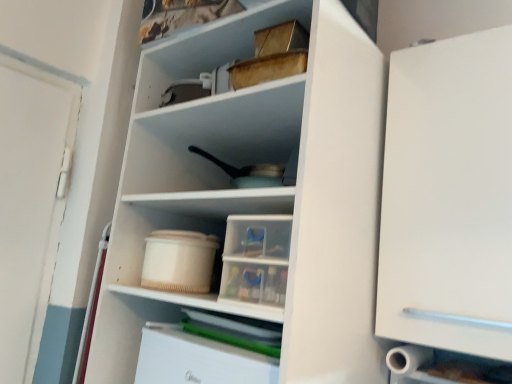
What is the approximate width of white plastic drawer at lower center, which is the 2th cabinetry from right to left?

45.67 centimeters.

This screenshot has height=384, width=512. Find the location of `white matte cabinet at right, which is counted as the second cabinetry, starting from the bottom`. white matte cabinet at right, which is counted as the second cabinetry, starting from the bottom is located at coordinates (448, 197).

Which is more distant, (306, 9) or (180, 276)?

The point (180, 276) is more distant.

Considering the relative sizes of wooden box at upper center and beige plastic container at center in the image provided, is wooden box at upper center taller than beige plastic container at center?

Yes, wooden box at upper center is taller than beige plastic container at center.

How many degrees apart are the facing directions of wooden box at upper center and beige plastic container at center?

wooden box at upper center and beige plastic container at center are facing 1.54 degrees away from each other.

Who is more distant, wooden box at upper center or beige plastic container at center?

beige plastic container at center is further away from the camera.

Is white plastic drawer at lower center, the 2th cabinetry from the top, positioned in front of beige plastic container at center?

Yes, white plastic drawer at lower center, the 2th cabinetry from the top, is closer to the camera.

Considering the sizes of objects white plastic drawer at lower center, which is the 2th cabinetry from right to left, and beige plastic container at center in the image provided, who is taller, white plastic drawer at lower center, which is the 2th cabinetry from right to left, or beige plastic container at center?

Standing taller between the two is white plastic drawer at lower center, which is the 2th cabinetry from right to left.

Based on their positions, is white plastic drawer at lower center, which is the 2th cabinetry from right to left, located to the left or right of beige plastic container at center?

white plastic drawer at lower center, which is the 2th cabinetry from right to left, is positioned on beige plastic container at center's right side.

From the image's perspective, is white plastic drawer at lower center, the 2th cabinetry from the top, over beige plastic container at center?

Actually, white plastic drawer at lower center, the 2th cabinetry from the top, appears below beige plastic container at center in the image.

Which is correct: white plastic drawer at lower center, the 1th cabinetry when ordered from bottom to top, is inside wooden box at upper center, or outside of it?

white plastic drawer at lower center, the 1th cabinetry when ordered from bottom to top, is located beyond the bounds of wooden box at upper center.

Is white plastic drawer at lower center, the 2th cabinetry from the top, touching wooden box at upper center?

No, white plastic drawer at lower center, the 2th cabinetry from the top, is not next to wooden box at upper center.

Which is closer to the camera, (187, 342) or (149, 103)?

Clearly, point (187, 342) is closer to the camera than point (149, 103).

Considering the relative sizes of white plastic drawer at lower center, which is the 1th cabinetry from left to right, and wooden box at upper center in the image provided, is white plastic drawer at lower center, which is the 1th cabinetry from left to right, smaller than wooden box at upper center?

Yes, white plastic drawer at lower center, which is the 1th cabinetry from left to right, is smaller than wooden box at upper center.

Is white matte cabinet at right, positioned as the first cabinetry in right-to-left order, wider or thinner than beige plastic container at center?

Considering their sizes, white matte cabinet at right, positioned as the first cabinetry in right-to-left order, looks broader than beige plastic container at center.

Is beige plastic container at center completely or partially inside white matte cabinet at right, which is counted as the second cabinetry, starting from the bottom?

No, beige plastic container at center is located outside of white matte cabinet at right, which is counted as the second cabinetry, starting from the bottom.

Can you confirm if white matte cabinet at right, marked as the second cabinetry in a left-to-right arrangement, is bigger than beige plastic container at center?

Yes.

Is point (451, 132) behind point (158, 331)?

No.

Which is more to the left, white matte cabinet at right, which is counted as the second cabinetry, starting from the bottom, or white plastic drawer at lower center, the 2th cabinetry from the top?

From the viewer's perspective, white plastic drawer at lower center, the 2th cabinetry from the top, appears more on the left side.

Is the position of white matte cabinet at right, marked as the second cabinetry in a left-to-right arrangement, less distant than that of white plastic drawer at lower center, the 1th cabinetry when ordered from bottom to top?

That is False.

In the scene shown: From the image's perspective, relative to white plastic drawer at lower center, which is the 2th cabinetry from right to left, is white matte cabinet at right, marked as the second cabinetry in a left-to-right arrangement, above or below?

From the image's perspective, white matte cabinet at right, marked as the second cabinetry in a left-to-right arrangement, appears above white plastic drawer at lower center, which is the 2th cabinetry from right to left.

From a real-world perspective, is white matte cabinet at right, marked as the second cabinetry in a left-to-right arrangement, positioned above or below wooden box at upper center?

From a real-world perspective, white matte cabinet at right, marked as the second cabinetry in a left-to-right arrangement, is physically below wooden box at upper center.

Is white matte cabinet at right, which is the 1th cabinetry from top to bottom, taller than wooden box at upper center?

Correct, white matte cabinet at right, which is the 1th cabinetry from top to bottom, is much taller as wooden box at upper center.

You are a GUI agent. You are given a task and a screenshot of the screen. Output one action in this format:
    pyautogui.click(x=<x>, y=<y>)
    Task: Click on the shelf positioned vertically above the white matte cabinet at right, positioned as the first cabinetry in right-to-left order (from a real-world perspective)
    This screenshot has height=384, width=512.
    Given the screenshot: What is the action you would take?
    coord(219,41)

From the image's perspective, is white matte cabinet at right, positioned as the first cabinetry in right-to-left order, located above wooden box at upper center?

Incorrect, from the image's perspective, white matte cabinet at right, positioned as the first cabinetry in right-to-left order, is lower than wooden box at upper center.

Image resolution: width=512 pixels, height=384 pixels. I want to click on storage box behind the white matte cabinet at right, which is counted as the second cabinetry, starting from the bottom, so click(x=179, y=261).

From a real-world perspective, is beige plastic container at center positioned over white matte cabinet at right, which is counted as the second cabinetry, starting from the bottom, based on gravity?

No, from a real-world perspective, beige plastic container at center is not over white matte cabinet at right, which is counted as the second cabinetry, starting from the bottom

From the picture: Which object is thinner, beige plastic container at center or white matte cabinet at right, which is the 1th cabinetry from top to bottom?

Thinner between the two is beige plastic container at center.

Locate an element on the screen. The width and height of the screenshot is (512, 384). storage box that appears on the left of wooden box at upper center is located at coordinates (179, 261).

Find the location of `storage box located behind the white plastic drawer at lower center, the 1th cabinetry when ordered from bottom to top`. storage box located behind the white plastic drawer at lower center, the 1th cabinetry when ordered from bottom to top is located at coordinates (179, 261).

From the image, which object appears to be nearer to white matte cabinet at right, positioned as the first cabinetry in right-to-left order, wooden box at upper center or white plastic drawer at lower center, which is the 1th cabinetry from left to right?

wooden box at upper center is positioned closer to the anchor white matte cabinet at right, positioned as the first cabinetry in right-to-left order.

Estimate the real-world distances between objects in this image. Which object is closer to wooden box at upper center, white plastic drawer at lower center, which is the 2th cabinetry from right to left, or white matte cabinet at right, marked as the second cabinetry in a left-to-right arrangement?

The object closer to wooden box at upper center is white matte cabinet at right, marked as the second cabinetry in a left-to-right arrangement.

In the scene shown: Based on their spatial positions, is white matte cabinet at right, which is counted as the second cabinetry, starting from the bottom, or white plastic drawer at lower center, which is the 2th cabinetry from right to left, closer to beige plastic container at center?

white plastic drawer at lower center, which is the 2th cabinetry from right to left.

Based on their spatial positions, is beige plastic container at center or white matte cabinet at right, marked as the second cabinetry in a left-to-right arrangement, closer to wooden box at upper center?

beige plastic container at center lies closer to wooden box at upper center than the other object.

When comparing their distances from white plastic drawer at lower center, which is the 1th cabinetry from left to right, does wooden box at upper center or beige plastic container at center seem closer?

beige plastic container at center is closer to white plastic drawer at lower center, which is the 1th cabinetry from left to right.

Based on their spatial positions, is white matte cabinet at right, marked as the second cabinetry in a left-to-right arrangement, or beige plastic container at center closer to white plastic drawer at lower center, the 1th cabinetry when ordered from bottom to top?

Among the two, beige plastic container at center is located nearer to white plastic drawer at lower center, the 1th cabinetry when ordered from bottom to top.

From the image, which object appears to be nearer to beige plastic container at center, white plastic drawer at lower center, the 1th cabinetry when ordered from bottom to top, or wooden box at upper center?

Among the two, white plastic drawer at lower center, the 1th cabinetry when ordered from bottom to top, is located nearer to beige plastic container at center.

From the picture: Based on their spatial positions, is beige plastic container at center or white matte cabinet at right, marked as the second cabinetry in a left-to-right arrangement, further from white plastic drawer at lower center, which is the 1th cabinetry from left to right?

white matte cabinet at right, marked as the second cabinetry in a left-to-right arrangement, is positioned further to the anchor white plastic drawer at lower center, which is the 1th cabinetry from left to right.

I want to click on cabinetry between wooden box at upper center and white plastic drawer at lower center, the 2th cabinetry from the top, in the up-down direction, so click(448, 197).

This screenshot has width=512, height=384. I want to click on storage box between wooden box at upper center and white plastic drawer at lower center, which is the 2th cabinetry from right to left, in the up-down direction, so click(179, 261).

At what (x,y) coordinates should I click in order to perform the action: click on cabinetry between wooden box at upper center and beige plastic container at center vertically. Please return your answer as a coordinate pair (x, y). The width and height of the screenshot is (512, 384). Looking at the image, I should click on (448, 197).

Identify the location of cabinetry between beige plastic container at center and white matte cabinet at right, positioned as the first cabinetry in right-to-left order. (198, 359).